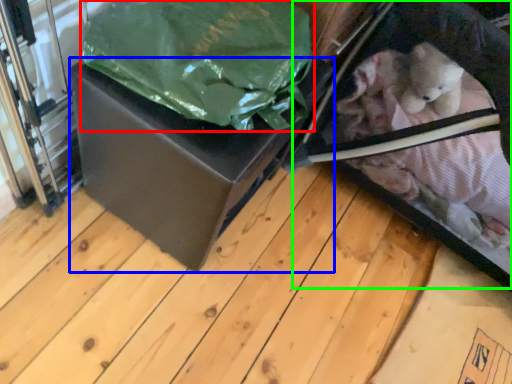
Question: Estimate the real-world distances between objects in this image. Which object is farther from plastic bag (highlighted by a red box), box (highlighted by a blue box) or baby carriage (highlighted by a green box)?

Choices:
 (A) box
 (B) baby carriage

Answer: (B)